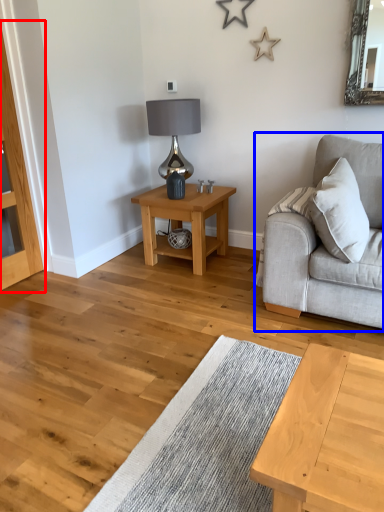
Question: Among these objects, which one is nearest to the camera, dresser (highlighted by a red box) or studio couch (highlighted by a blue box)?

Choices:
 (A) dresser
 (B) studio couch

Answer: (B)